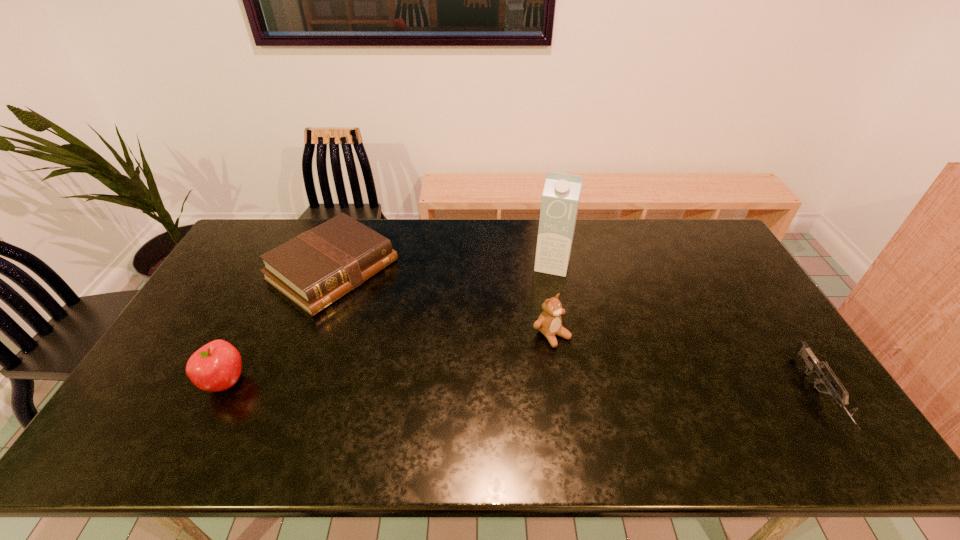
This screenshot has width=960, height=540. I want to click on apple, so click(216, 366).

At what (x,y) coordinates should I click in order to perform the action: click on the rightmost object. Please return your answer as a coordinate pair (x, y). The image size is (960, 540). Looking at the image, I should click on (812, 363).

Locate an element on the screen. the shortest object is located at coordinates (812, 363).

Find the location of a particular element. This screenshot has width=960, height=540. carton is located at coordinates tap(560, 200).

Where is `teddy bear`? This screenshot has height=540, width=960. teddy bear is located at coordinates (549, 323).

Image resolution: width=960 pixels, height=540 pixels. In order to click on Bible in this screenshot , I will do `click(316, 268)`.

This screenshot has width=960, height=540. In order to click on blank space located 0.380m on the back of the apple in this screenshot , I will do `click(281, 271)`.

The height and width of the screenshot is (540, 960). What are the coordinates of `blank space located 0.210m on the front label of the carton` in the screenshot? It's located at (538, 322).

The width and height of the screenshot is (960, 540). I want to click on free space located 0.050m on the front label of the carton, so click(546, 287).

At what (x,y) coordinates should I click in order to perform the action: click on vacant space positioned on the front label of the carton. Please return your answer as a coordinate pair (x, y). This screenshot has height=540, width=960. Looking at the image, I should click on (543, 299).